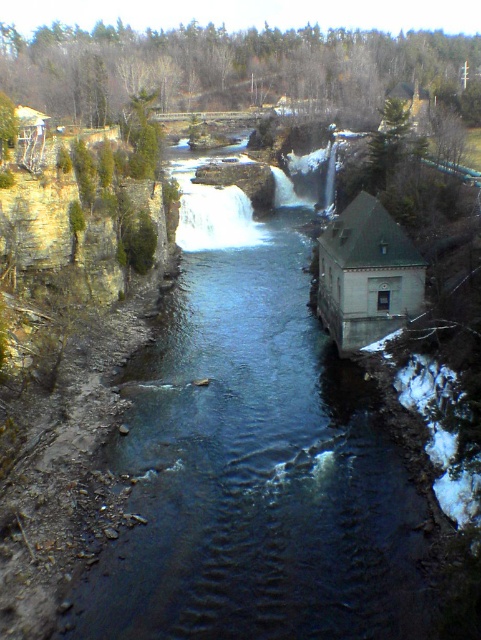
Is gray stone mill at center-right taller than white frothy water at center?

No.

Which is below, gray stone mill at center-right or white frothy water at center?

gray stone mill at center-right is below.

Which is behind, point (365, 317) or point (235, 243)?

The point (235, 243) is behind.

At what (x,y) coordinates should I click in order to perform the action: click on gray stone mill at center-right. Please return your answer as a coordinate pair (x, y). This screenshot has height=640, width=481. Looking at the image, I should click on (367, 275).

Measure the distance between point (409, 545) and camera.

The distance of point (409, 545) from camera is 28.47 meters.

Who is positioned more to the left, dark blue water at center or white frothy water at center?

Positioned to the left is white frothy water at center.

Between point (210, 509) and point (223, 195), which one is positioned in front?

Point (210, 509)

You are a GUI agent. You are given a task and a screenshot of the screen. Output one action in this format:
    pyautogui.click(x=<x>, y=<y>)
    Task: Click on the dark blue water at center
    
    Given the screenshot: What is the action you would take?
    pyautogui.click(x=255, y=470)

In the scene shown: Is dark blue water at center taller than gray stone mill at center-right?

Indeed, dark blue water at center has a greater height compared to gray stone mill at center-right.

Is dark blue water at center shorter than gray stone mill at center-right?

No.

Is point (210, 486) behind point (349, 248)?

No, it is in front of (349, 248).

Identify the location of dark blue water at center. This screenshot has height=640, width=481. (255, 470).